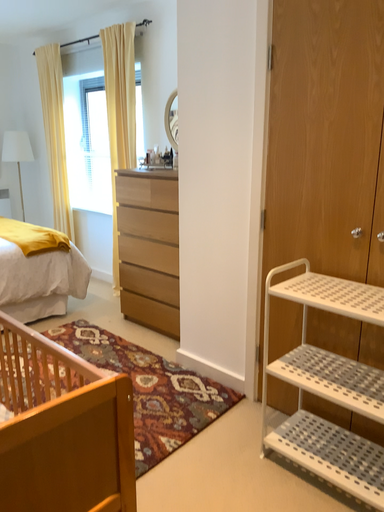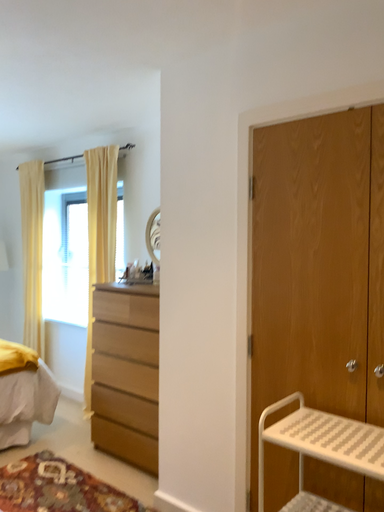
Question: Which way did the camera rotate in the video?

Choices:
 (A) rotated downward
 (B) rotated upward

Answer: (B)